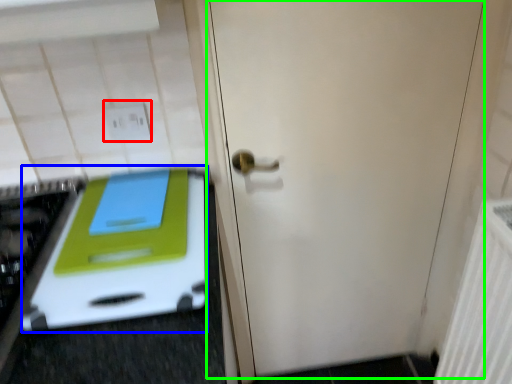
Question: Which object is positioned closest to electric outlet (highlighted by a red box)? Select from oven (highlighted by a blue box) and door (highlighted by a green box).

Choices:
 (A) oven
 (B) door

Answer: (A)